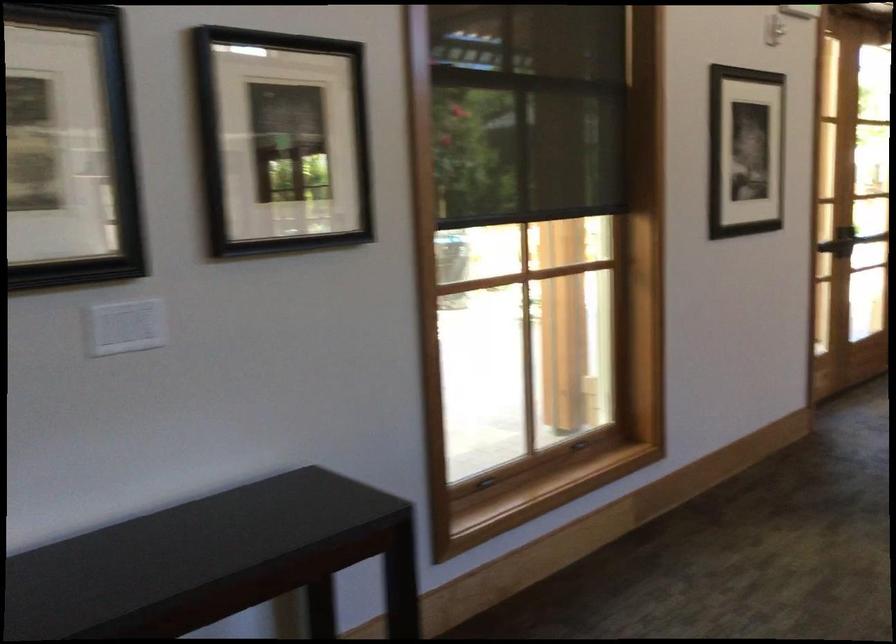
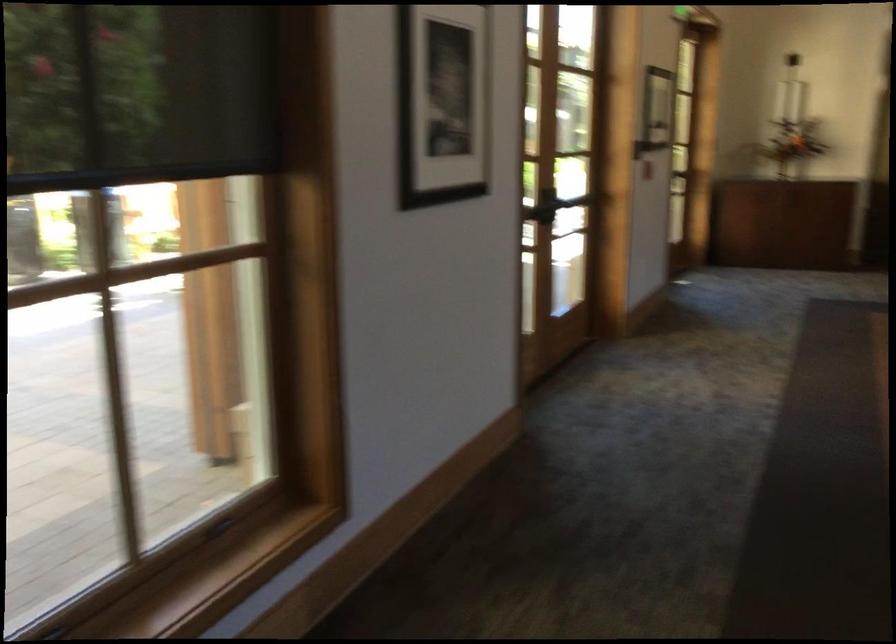
Question: What movement of the cameraman would produce the second image?

Choices:
 (A) Left
 (B) Right
 (C) Forward
 (D) Backward

Answer: (C)